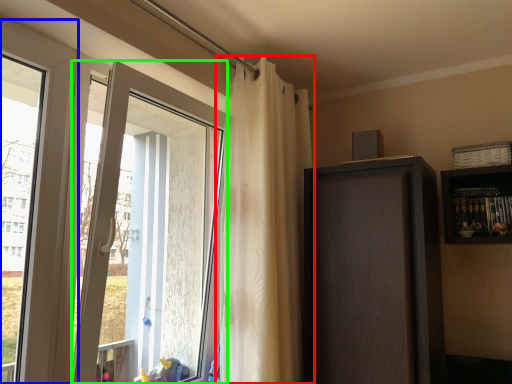
Question: Based on their relative distances, which object is nearer to curtain (highlighted by a red box)? Choose from window (highlighted by a blue box) and door (highlighted by a green box).

Choices:
 (A) window
 (B) door

Answer: (B)